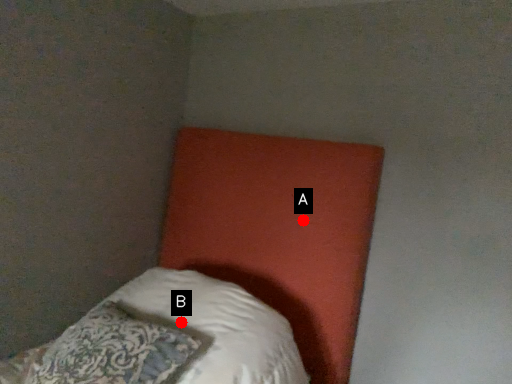
Question: Two points are circled on the image, labeled by A and B beside each circle. Which point is farther to the camera?

Choices:
 (A) A is further
 (B) B is further

Answer: (A)